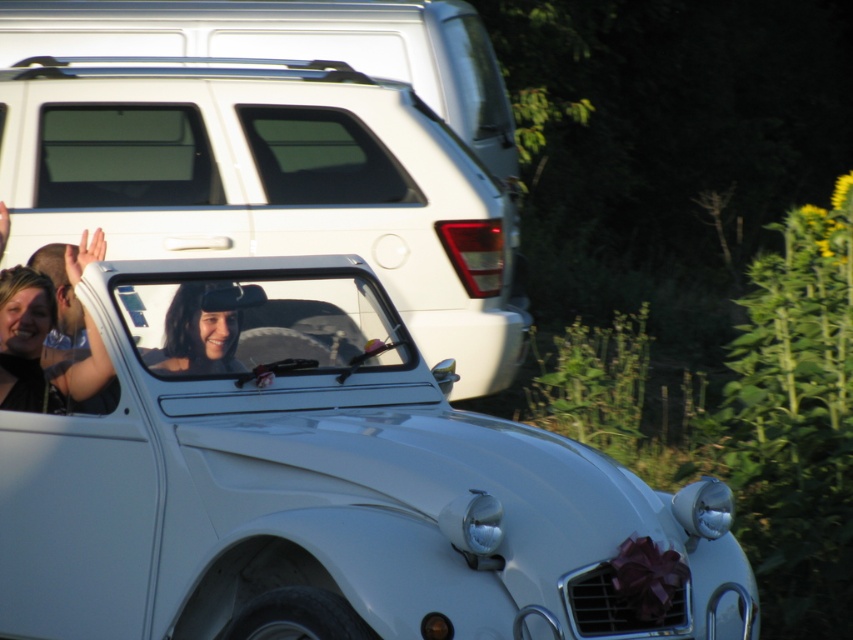
Is white matte suv at upper left bigger than matte black hair at upper left?

Yes.

Consider the image. Which is above, white matte suv at upper left or matte black hair at upper left?

white matte suv at upper left is higher up.

Does point (183, 172) lie behind point (48, 328)?

Yes, point (183, 172) is behind point (48, 328).

I want to click on white matte suv at upper left, so click(x=270, y=182).

Does white glossy car at center have a greater width compared to matte black hair at upper left?

Indeed, white glossy car at center has a greater width compared to matte black hair at upper left.

Does point (4, 627) come closer to viewer compared to point (56, 397)?

Yes, it is in front of point (56, 397).

The image size is (853, 640). Describe the element at coordinates (329, 490) in the screenshot. I see `white glossy car at center` at that location.

This screenshot has height=640, width=853. In order to click on white glossy car at center in this screenshot , I will do [329, 490].

Does matte black hat at center have a smaller size compared to matte black hair at upper left?

Correct, matte black hat at center occupies less space than matte black hair at upper left.

Between matte black hat at center and matte black hair at upper left, which one appears on the right side from the viewer's perspective?

From the viewer's perspective, matte black hat at center appears more on the right side.

The height and width of the screenshot is (640, 853). In order to click on matte black hat at center in this screenshot , I will do `click(202, 328)`.